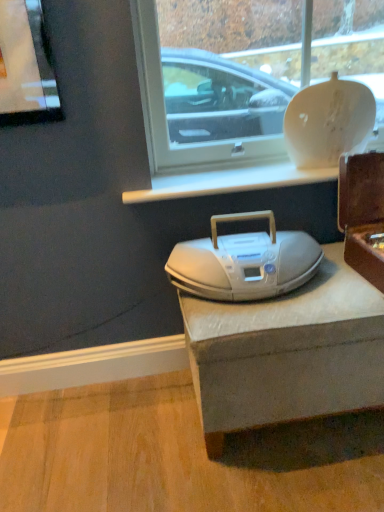
Question: Is brown wooden box at right with white plastic boombox at center?

Choices:
 (A) no
 (B) yes

Answer: (A)

Question: Does brown wooden box at right lie behind white plastic boombox at center?

Choices:
 (A) yes
 (B) no

Answer: (B)

Question: From a real-world perspective, is brown wooden box at right on top of white plastic boombox at center?

Choices:
 (A) yes
 (B) no

Answer: (A)

Question: Can you confirm if brown wooden box at right is wider than white plastic boombox at center?

Choices:
 (A) yes
 (B) no

Answer: (A)

Question: Is brown wooden box at right oriented away from white plastic boombox at center?

Choices:
 (A) no
 (B) yes

Answer: (A)

Question: In the image, is white glossy vase at upper center positioned in front of or behind brown wooden box at right?

Choices:
 (A) front
 (B) behind

Answer: (B)

Question: Would you say white glossy vase at upper center is to the left or to the right of brown wooden box at right in the picture?

Choices:
 (A) left
 (B) right

Answer: (A)

Question: Considering the positions of white glossy vase at upper center and brown wooden box at right in the image, is white glossy vase at upper center taller or shorter than brown wooden box at right?

Choices:
 (A) short
 (B) tall

Answer: (B)

Question: Is point (140, 53) closer or farther from the camera than point (375, 274)?

Choices:
 (A) farther
 (B) closer

Answer: (A)

Question: From a real-world perspective, is brown wooden box at right physically located above or below white plastic boombox at center?

Choices:
 (A) above
 (B) below

Answer: (A)

Question: Considering the positions of brown wooden box at right and white plastic boombox at center in the image, is brown wooden box at right wider or thinner than white plastic boombox at center?

Choices:
 (A) wide
 (B) thin

Answer: (A)

Question: Is brown wooden box at right to the left or to the right of white plastic boombox at center in the image?

Choices:
 (A) left
 (B) right

Answer: (B)

Question: Is brown wooden box at right situated inside white plastic boombox at center or outside?

Choices:
 (A) outside
 (B) inside

Answer: (A)

Question: Does point (365, 181) appear closer or farther from the camera than point (382, 89)?

Choices:
 (A) farther
 (B) closer

Answer: (B)

Question: In terms of width, does brown wooden box at right look wider or thinner when compared to white glossy vase at upper center?

Choices:
 (A) wide
 (B) thin

Answer: (A)